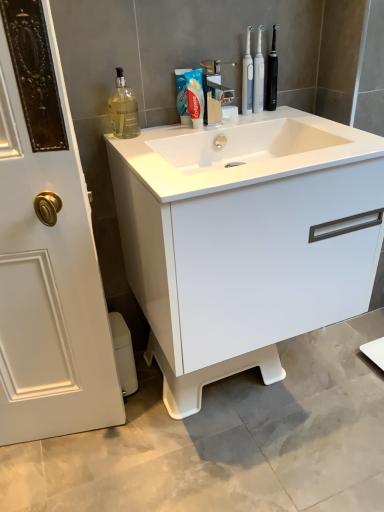
Locate an element on the screen. vacant space situated on the left part of white matte toothpaste at center is located at coordinates (153, 132).